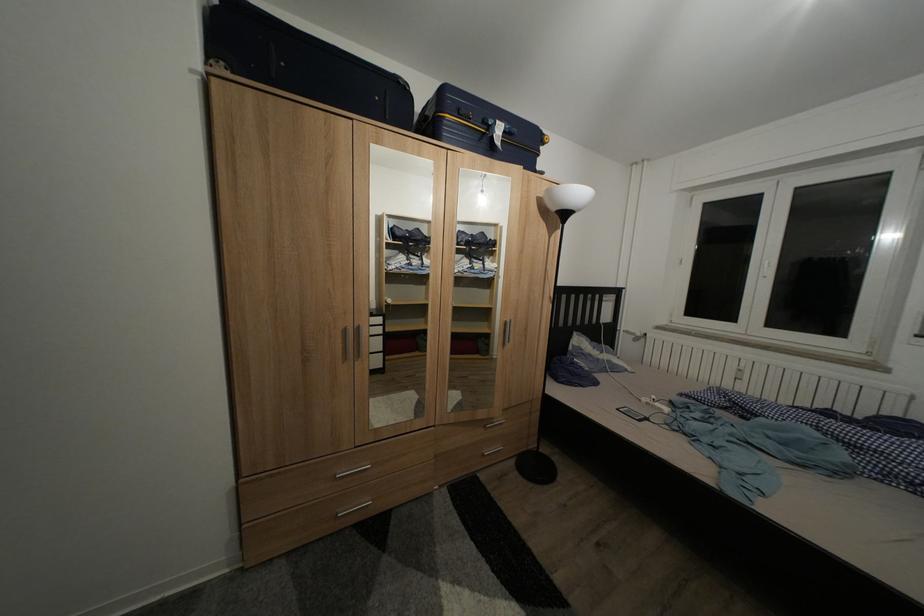
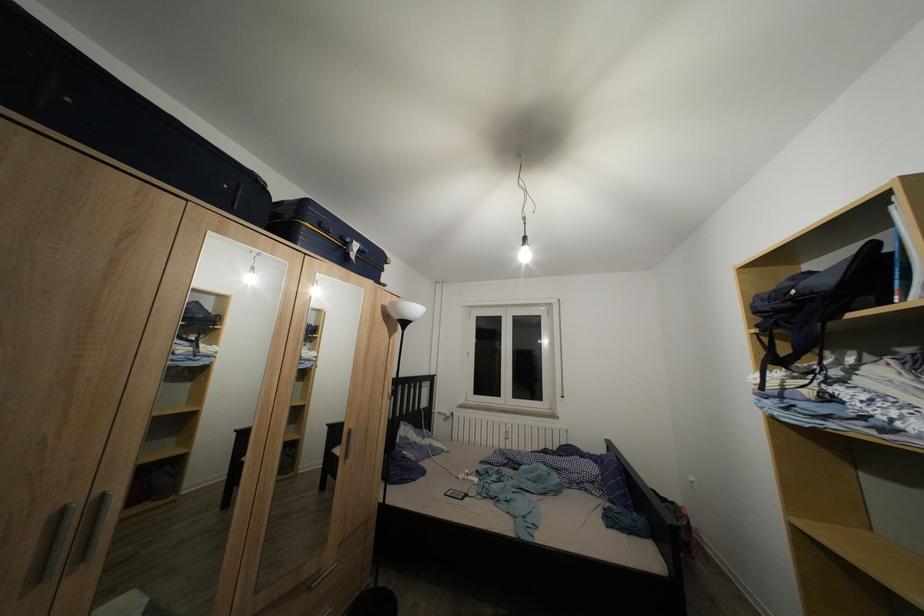
Locate, in the second image, the point that corresponds to [513,138] in the first image.

(367, 257)